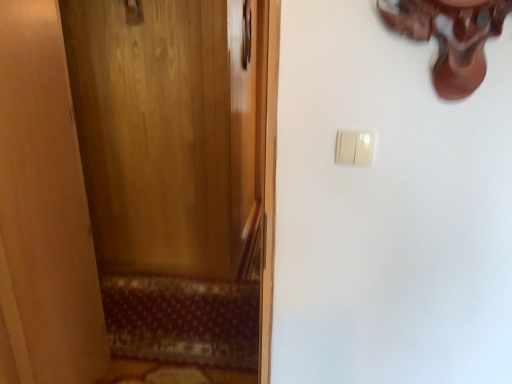
Question: Does polished brass door handle at upper left turn towards patterned carpet at lower left?

Choices:
 (A) yes
 (B) no

Answer: (B)

Question: Is polished brass door handle at upper left looking in the opposite direction of patterned carpet at lower left?

Choices:
 (A) yes
 (B) no

Answer: (B)

Question: Does polished brass door handle at upper left have a lesser width compared to patterned carpet at lower left?

Choices:
 (A) yes
 (B) no

Answer: (A)

Question: Does polished brass door handle at upper left have a larger size compared to patterned carpet at lower left?

Choices:
 (A) no
 (B) yes

Answer: (A)

Question: Does polished brass door handle at upper left have a greater height compared to patterned carpet at lower left?

Choices:
 (A) yes
 (B) no

Answer: (A)

Question: Is point (251, 349) closer or farther from the camera than point (146, 327)?

Choices:
 (A) closer
 (B) farther

Answer: (A)

Question: Considering the positions of patterned carpet at lower left and wooden door at left in the image, is patterned carpet at lower left bigger or smaller than wooden door at left?

Choices:
 (A) big
 (B) small

Answer: (B)

Question: Considering their positions, is patterned carpet at lower left located in front of or behind wooden door at left?

Choices:
 (A) front
 (B) behind

Answer: (B)

Question: Is patterned carpet at lower left spatially inside wooden door at left, or outside of it?

Choices:
 (A) outside
 (B) inside

Answer: (A)

Question: Considering their positions, is wooden door at left located in front of or behind white plastic light switch at upper right?

Choices:
 (A) front
 (B) behind

Answer: (A)

Question: In terms of width, does wooden door at left look wider or thinner when compared to white plastic light switch at upper right?

Choices:
 (A) wide
 (B) thin

Answer: (A)

Question: In the image, is wooden door at left on the left side or the right side of white plastic light switch at upper right?

Choices:
 (A) right
 (B) left

Answer: (B)

Question: From the image's perspective, is wooden door at left positioned above or below white plastic light switch at upper right?

Choices:
 (A) below
 (B) above

Answer: (A)

Question: Considering the relative positions of wooden door at left and patterned carpet at lower left in the image provided, is wooden door at left to the left or to the right of patterned carpet at lower left?

Choices:
 (A) left
 (B) right

Answer: (B)

Question: Based on their sizes in the image, would you say wooden door at left is bigger or smaller than patterned carpet at lower left?

Choices:
 (A) big
 (B) small

Answer: (A)